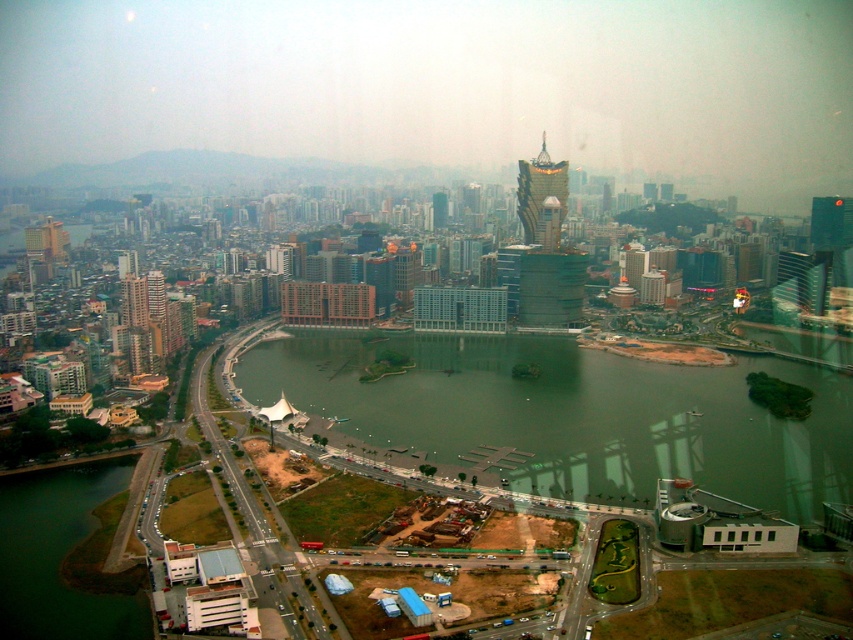
Can you confirm if green water at center is taller than gold reflective tower at center?

In fact, green water at center may be shorter than gold reflective tower at center.

Is green water at center shorter than gold reflective tower at center?

Yes.

Is point (717, 476) positioned in front of point (523, 161)?

That is True.

The width and height of the screenshot is (853, 640). Find the location of `green water at center`. green water at center is located at coordinates (572, 413).

Who is more forward, (144, 625) or (544, 172)?

Point (144, 625)

Can you confirm if green grassy embankment at lower left is positioned to the right of gold reflective tower at center?

Incorrect, green grassy embankment at lower left is not on the right side of gold reflective tower at center.

The height and width of the screenshot is (640, 853). In order to click on green grassy embankment at lower left in this screenshot , I will do `click(59, 556)`.

Is gold metallic tower at center positioned in front of gold reflective tower at center?

Yes, it is in front of gold reflective tower at center.

Image resolution: width=853 pixels, height=640 pixels. What do you see at coordinates (544, 250) in the screenshot? I see `gold metallic tower at center` at bounding box center [544, 250].

Which is behind, point (529, 179) or point (520, 192)?

The point (520, 192) is behind.

Image resolution: width=853 pixels, height=640 pixels. Identify the location of gold metallic tower at center. coord(544,250).